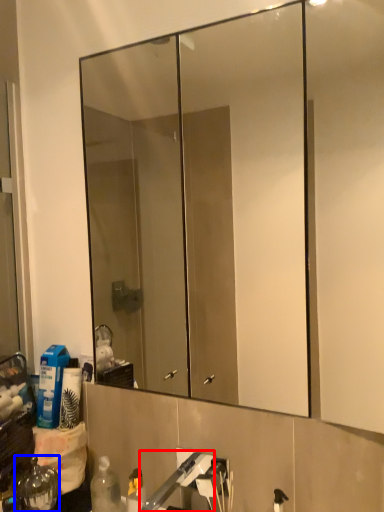
Question: Among these objects, which one is nearest to the camera, faucet (highlighted by a red box) or bottle (highlighted by a blue box)?

Choices:
 (A) faucet
 (B) bottle

Answer: (A)